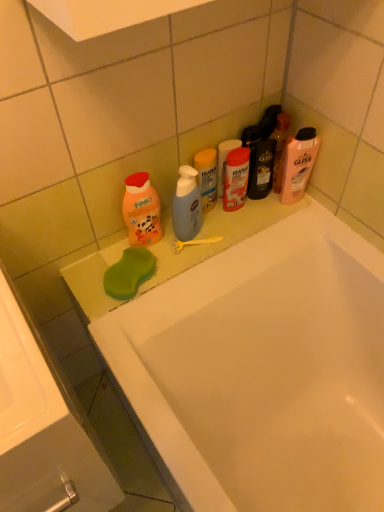
Question: From the image's perspective, is orange matte baby soap at left, which is counted as the 3th cleaning product, starting from the right, positioned above or below translucent plastic bottle at center, arranged as the 2th cleaning product when viewed from the left?

Choices:
 (A) above
 (B) below

Answer: (B)

Question: Is orange matte baby soap at left, which is the first cleaning product in left-to-right order, wider or thinner than translucent plastic bottle at center, the second cleaning product positioned from the right?

Choices:
 (A) wide
 (B) thin

Answer: (A)

Question: Considering the real-world distances, which object is farthest from the orange matte baby soap at left, which is the first cleaning product in left-to-right order?

Choices:
 (A) white glossy bathtub at upper center
 (B) white glossy sink at lower left
 (C) translucent plastic bottle at center, the second cleaning product positioned from the right
 (D) pink matte shampoo at upper right, marked as the 3th cleaning product in a left-to-right arrangement

Answer: (B)

Question: Estimate the real-world distances between objects in this image. Which object is closer to the white glossy sink at lower left?

Choices:
 (A) orange matte baby soap at left, which is the first cleaning product in left-to-right order
 (B) translucent plastic bottle at center, arranged as the 2th cleaning product when viewed from the left
 (C) white glossy bathtub at upper center
 (D) pink matte shampoo at upper right, marked as the 3th cleaning product in a left-to-right arrangement

Answer: (C)